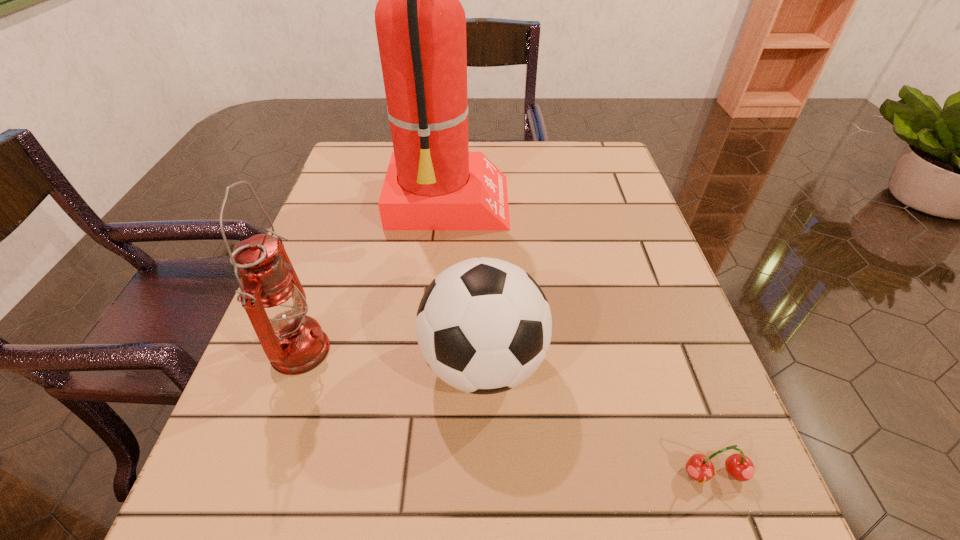
This screenshot has height=540, width=960. Find the location of `vacant position in the image that satisfies the following two spatial constraints: 1. on the front-facing side of the tallest object; 2. on the right side of the second shortest object`. vacant position in the image that satisfies the following two spatial constraints: 1. on the front-facing side of the tallest object; 2. on the right side of the second shortest object is located at coordinates (436, 363).

You are a GUI agent. You are given a task and a screenshot of the screen. Output one action in this format:
    pyautogui.click(x=<x>, y=<y>)
    Task: Click on the vacant space that satisfies the following two spatial constraints: 1. on the front-facing side of the fire extinguisher; 2. on the front side of the third shortest object
    This screenshot has width=960, height=540.
    Given the screenshot: What is the action you would take?
    pyautogui.click(x=437, y=352)